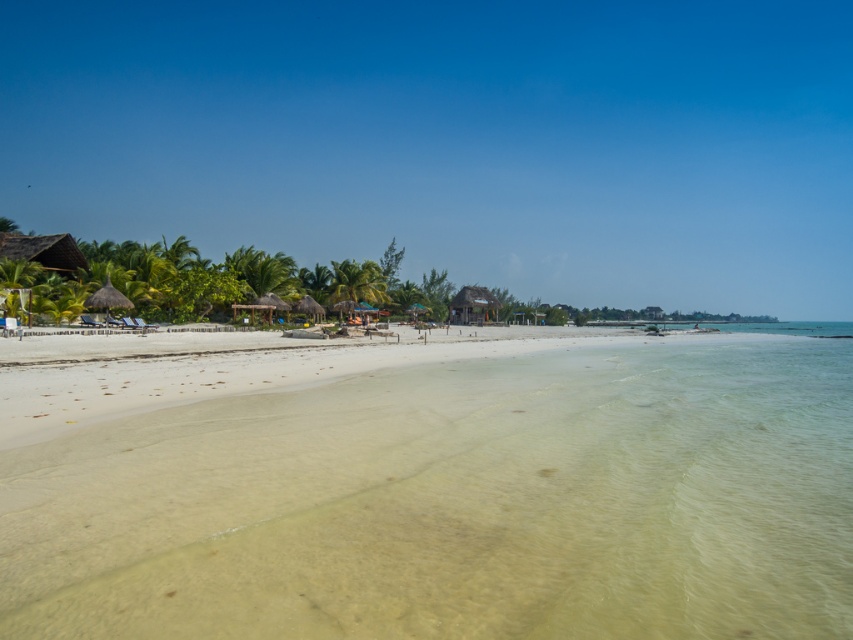
Does white sand beach at center have a lesser height compared to thatched roof hut at center?

Yes, white sand beach at center is shorter than thatched roof hut at center.

Between point (381, 579) and point (467, 307), which one is positioned behind?

Point (467, 307)

Locate an element on the screen. Image resolution: width=853 pixels, height=640 pixels. white sand beach at center is located at coordinates (456, 502).